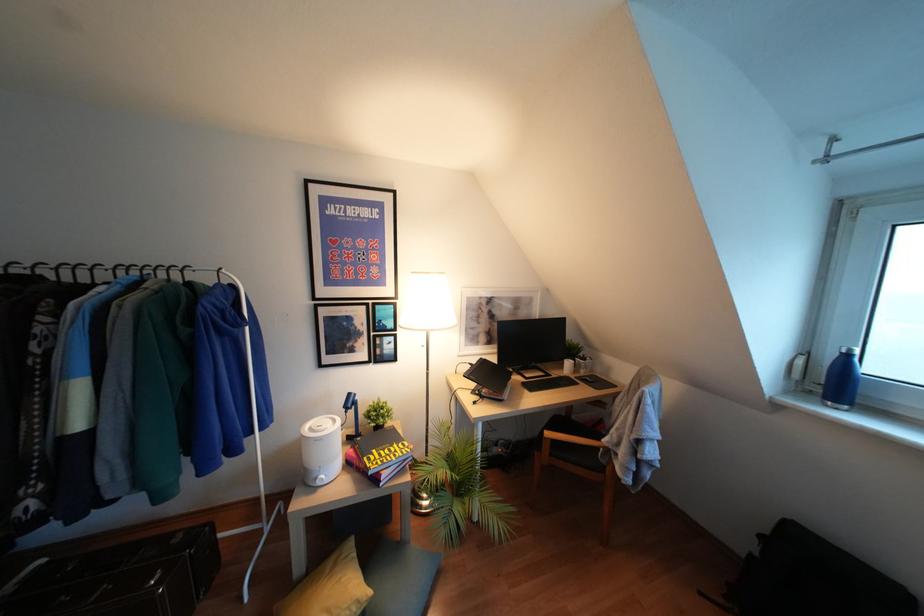
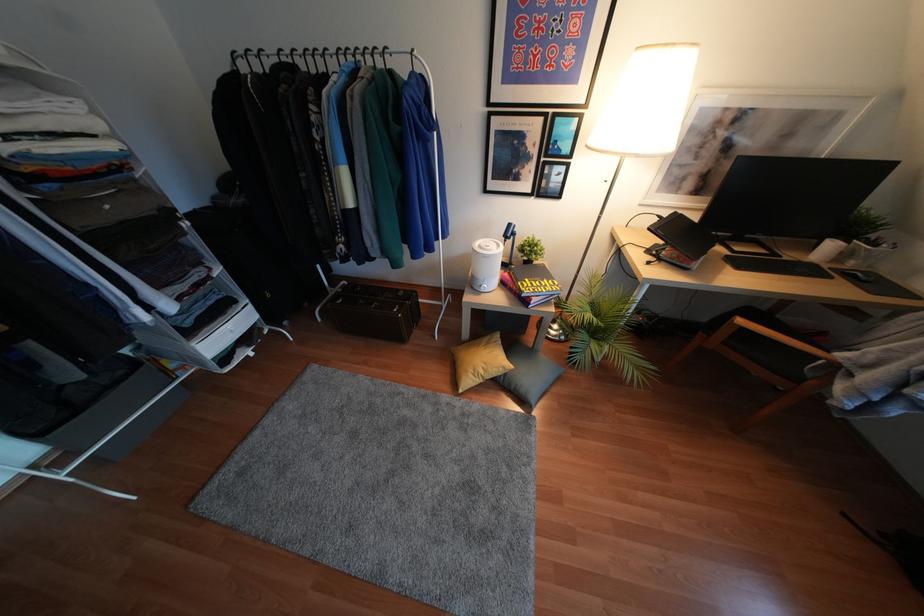
Where in the second image is the point corresponding to point (319, 483) from the first image?

(481, 290)